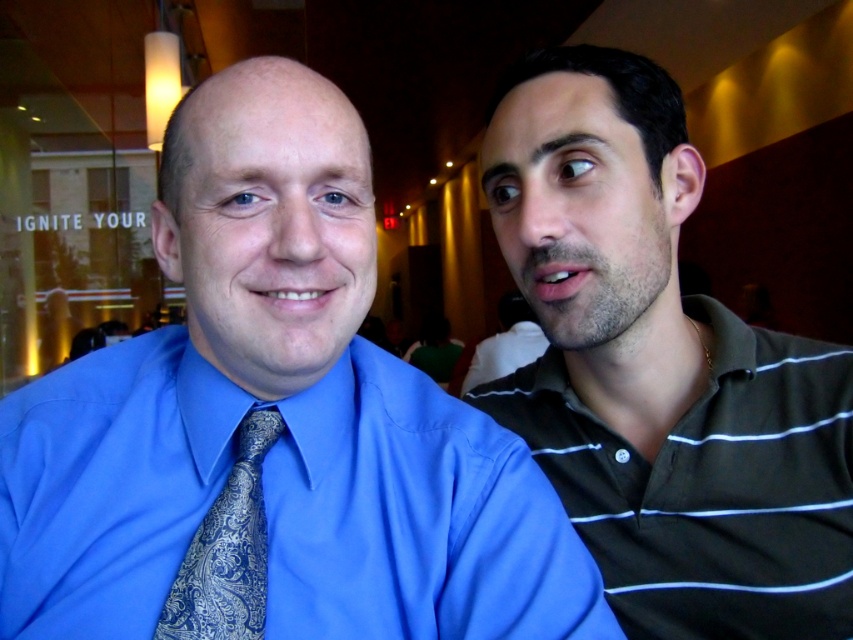
Does blue satin shirt at center have a greater width compared to striped jersey shirt at right?

Yes.

The width and height of the screenshot is (853, 640). What do you see at coordinates (273, 426) in the screenshot?
I see `blue satin shirt at center` at bounding box center [273, 426].

From the picture: Measure the distance between point (323, 268) and camera.

Point (323, 268) and camera are 21.79 inches apart from each other.

Image resolution: width=853 pixels, height=640 pixels. In order to click on blue satin shirt at center in this screenshot , I will do `click(273, 426)`.

Who is more forward, [225,540] or [532,323]?

Point [225,540]

Measure the distance between blue paisley tie at center and striped jersey shirt at right.

blue paisley tie at center and striped jersey shirt at right are 2.74 meters apart.

Who is more distant from viewer, (163, 618) or (515, 294)?

Point (515, 294)

Find the location of `blue paisley tie at center`. blue paisley tie at center is located at coordinates (227, 548).

Is point (194, 452) closer to viewer compared to point (207, 513)?

No, it is not.

Which is more to the right, blue satin shirt at center or blue paisley tie at center?

Positioned to the right is blue paisley tie at center.

The height and width of the screenshot is (640, 853). What do you see at coordinates (273, 426) in the screenshot?
I see `blue satin shirt at center` at bounding box center [273, 426].

The width and height of the screenshot is (853, 640). In order to click on blue satin shirt at center in this screenshot , I will do `click(273, 426)`.